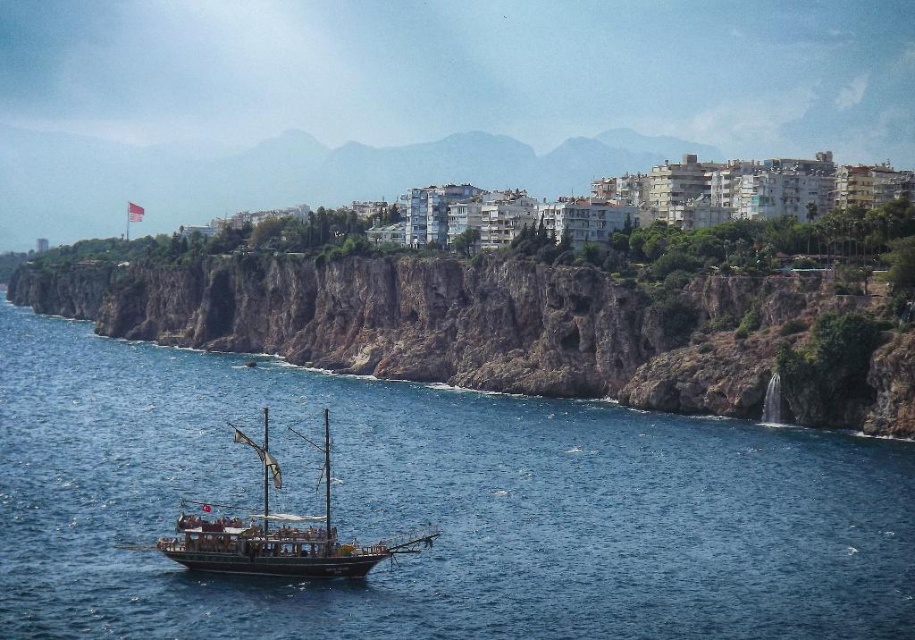
You are standing at the point marked as point (491, 326) in the coastal scene. What is the closest object to you?

The rugged rock cliff at center is located at point (491, 326), so you are standing on it. Therefore, the closest object to you is the rugged rock cliff at center itself.

Looking at this image, you are a photographer planning to capture the blue water at center and the wooden ship at center in a single shot. Based on their positions, which one would appear larger in the photo?

The blue water at center appears larger in the photo because it is much taller than the wooden ship at center according to their positions.

You are a tourist standing on the shore looking out at the blue water at center and the rugged rock cliff at center. Which object is closer to you?

The blue water at center is closer to you because it is positioned in front of the rugged rock cliff at center.